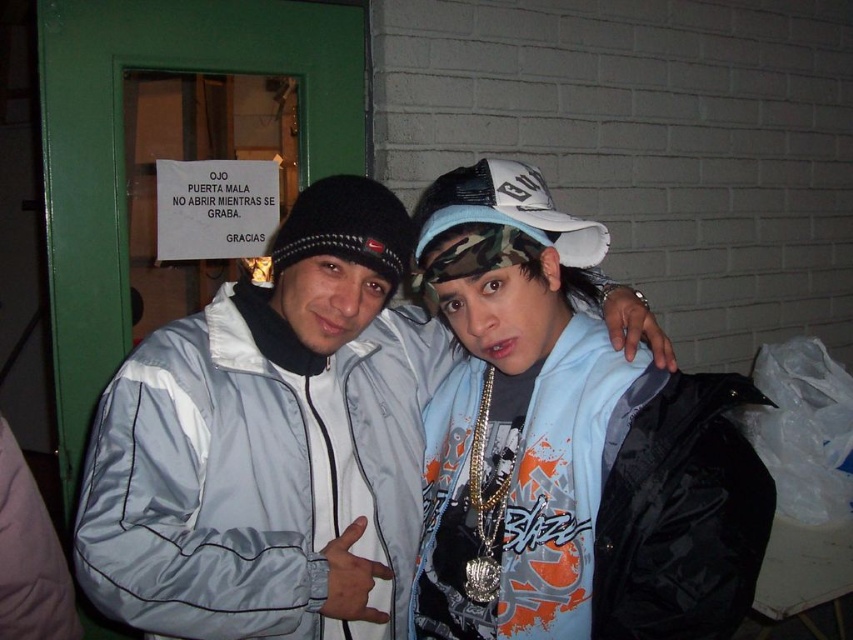
The height and width of the screenshot is (640, 853). What do you see at coordinates (270, 444) in the screenshot?
I see `light gray jacket at center` at bounding box center [270, 444].

Can you confirm if light gray jacket at center is taller than camo fabric baseball cap at upper center?

Yes.

Is point (91, 484) more distant than point (480, 218)?

No, it is not.

I want to click on light gray jacket at center, so click(x=270, y=444).

Does light gray jacket at center have a greater height compared to light blue fabric shirt at center?

No.

Which is behind, point (332, 276) or point (518, 580)?

Positioned behind is point (332, 276).

The height and width of the screenshot is (640, 853). Identify the location of light gray jacket at center. (270, 444).

Find the location of a particular element. light gray jacket at center is located at coordinates (270, 444).

Can you confirm if light blue fabric shirt at center is taller than camo fabric baseball cap at upper center?

Indeed, light blue fabric shirt at center has a greater height compared to camo fabric baseball cap at upper center.

The image size is (853, 640). What do you see at coordinates (567, 444) in the screenshot?
I see `light blue fabric shirt at center` at bounding box center [567, 444].

Where is `light blue fabric shirt at center`? light blue fabric shirt at center is located at coordinates (567, 444).